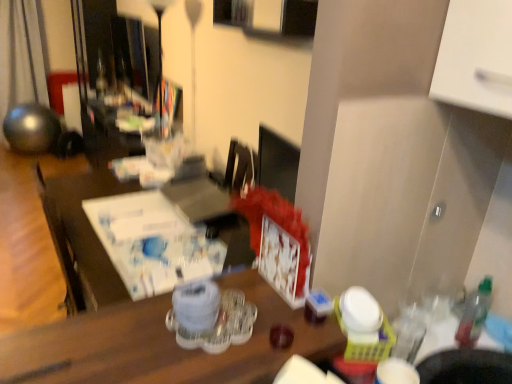
Question: Is metallic sphere at left not within clear plastic tray at center?

Choices:
 (A) yes
 (B) no

Answer: (A)

Question: From a real-world perspective, does metallic sphere at left stand above clear plastic tray at center?

Choices:
 (A) yes
 (B) no

Answer: (B)

Question: Could clear plastic tray at center be considered to be inside metallic sphere at left?

Choices:
 (A) no
 (B) yes

Answer: (A)

Question: Is metallic sphere at left positioned with its back to clear plastic tray at center?

Choices:
 (A) no
 (B) yes

Answer: (A)

Question: Is metallic sphere at left shorter than clear plastic tray at center?

Choices:
 (A) no
 (B) yes

Answer: (A)

Question: Is metallic sphere at left aimed at clear plastic tray at center?

Choices:
 (A) yes
 (B) no

Answer: (B)

Question: Is translucent plastic bottle at right thinner than metallic sphere at left?

Choices:
 (A) no
 (B) yes

Answer: (B)

Question: Is translucent plastic bottle at right positioned in front of metallic sphere at left?

Choices:
 (A) no
 (B) yes

Answer: (B)

Question: Is metallic sphere at left completely or partially inside translucent plastic bottle at right?

Choices:
 (A) no
 (B) yes

Answer: (A)

Question: Can you confirm if translucent plastic bottle at right is bigger than metallic sphere at left?

Choices:
 (A) no
 (B) yes

Answer: (A)

Question: Is translucent plastic bottle at right to the right of metallic sphere at left from the viewer's perspective?

Choices:
 (A) no
 (B) yes

Answer: (B)

Question: Considering the relative positions of translucent plastic bottle at right and metallic sphere at left in the image provided, is translucent plastic bottle at right behind metallic sphere at left?

Choices:
 (A) yes
 (B) no

Answer: (B)

Question: Is translucent plastic bottle at right aimed at clear plastic tray at center?

Choices:
 (A) no
 (B) yes

Answer: (A)